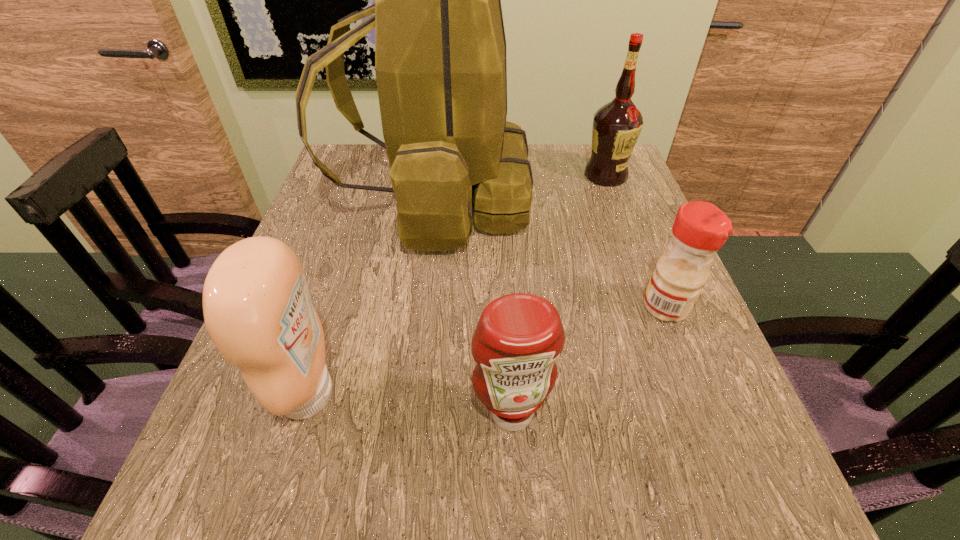
Where is `vacant region located on the left of the second condiment from right to left`? This screenshot has width=960, height=540. vacant region located on the left of the second condiment from right to left is located at coordinates click(x=436, y=412).

Image resolution: width=960 pixels, height=540 pixels. I want to click on vacant space positioned 0.080m on the back of the third farthest object, so click(x=649, y=264).

Where is `backpack that is positioned at the far edge`? The width and height of the screenshot is (960, 540). backpack that is positioned at the far edge is located at coordinates (440, 49).

In order to click on alcohol that is at the far edge in this screenshot , I will do `click(617, 125)`.

The image size is (960, 540). Identify the location of backpack that is at the left edge. (440, 49).

Where is `condiment situated at the left edge`? condiment situated at the left edge is located at coordinates (257, 309).

This screenshot has width=960, height=540. What are the coordinates of `alcohol present at the right edge` in the screenshot? It's located at (617, 125).

This screenshot has height=540, width=960. Find the location of `condiment situated at the right edge`. condiment situated at the right edge is located at coordinates (700, 229).

Identify the location of object situated at the far left corner. (440, 49).

Where is `object situated at the far right corner`? The image size is (960, 540). object situated at the far right corner is located at coordinates tap(617, 125).